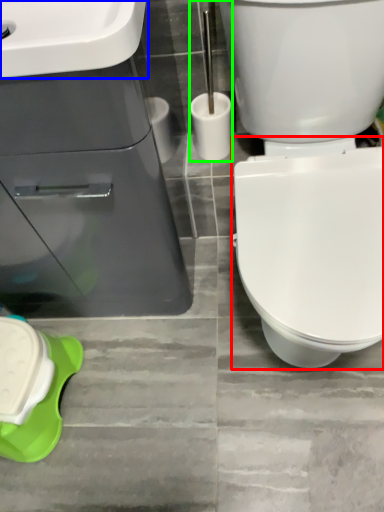
Question: Considering the real-world distances, which object is closest to bidet (highlighted by a red box)? sink (highlighted by a blue box) or brush (highlighted by a green box).

Choices:
 (A) sink
 (B) brush

Answer: (B)